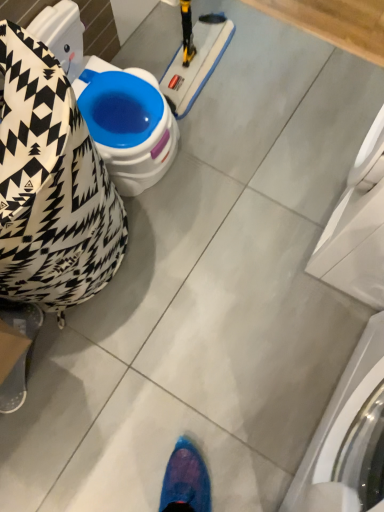
Question: Should I look upward or downward to see black and white patterned bean bag chair at left?

Choices:
 (A) down
 (B) up

Answer: (B)

Question: Is white glossy washing machine at right, arranged as the first washing machine when viewed from the top, taller than black and white patterned bean bag chair at left?

Choices:
 (A) yes
 (B) no

Answer: (A)

Question: Is white glossy washing machine at right, arranged as the first washing machine when viewed from the top, turned away from black and white patterned bean bag chair at left?

Choices:
 (A) no
 (B) yes

Answer: (A)

Question: Would you say black and white patterned bean bag chair at left is part of white glossy washing machine at right, the 2th washing machine from the bottom,'s contents?

Choices:
 (A) no
 (B) yes

Answer: (A)

Question: Is white glossy washing machine at right, arranged as the first washing machine when viewed from the top, smaller than black and white patterned bean bag chair at left?

Choices:
 (A) no
 (B) yes

Answer: (A)

Question: Does white glossy washing machine at right, arranged as the first washing machine when viewed from the top, appear on the left side of black and white patterned bean bag chair at left?

Choices:
 (A) yes
 (B) no

Answer: (B)

Question: Is black and white patterned bean bag chair at left to the left of white glossy washing machine at lower right, arranged as the 1th washing machine when ordered from the bottom, from the viewer's perspective?

Choices:
 (A) yes
 (B) no

Answer: (A)

Question: Could you tell me if black and white patterned bean bag chair at left is turned towards white glossy washing machine at lower right, which is the second washing machine from top to bottom?

Choices:
 (A) no
 (B) yes

Answer: (B)

Question: Considering the relative sizes of black and white patterned bean bag chair at left and white glossy washing machine at lower right, arranged as the 1th washing machine when ordered from the bottom, in the image provided, is black and white patterned bean bag chair at left bigger than white glossy washing machine at lower right, arranged as the 1th washing machine when ordered from the bottom,?

Choices:
 (A) yes
 (B) no

Answer: (B)

Question: Is black and white patterned bean bag chair at left far from white glossy washing machine at lower right, arranged as the 1th washing machine when ordered from the bottom?

Choices:
 (A) no
 (B) yes

Answer: (A)

Question: Does black and white patterned bean bag chair at left come behind white glossy washing machine at lower right, arranged as the 1th washing machine when ordered from the bottom?

Choices:
 (A) no
 (B) yes

Answer: (B)

Question: Is black and white patterned bean bag chair at left oriented away from white glossy washing machine at lower right, arranged as the 1th washing machine when ordered from the bottom?

Choices:
 (A) no
 (B) yes

Answer: (A)

Question: From the image's perspective, is white glossy washing machine at lower right, arranged as the 1th washing machine when ordered from the bottom, on black and white patterned bean bag chair at left?

Choices:
 (A) no
 (B) yes

Answer: (A)